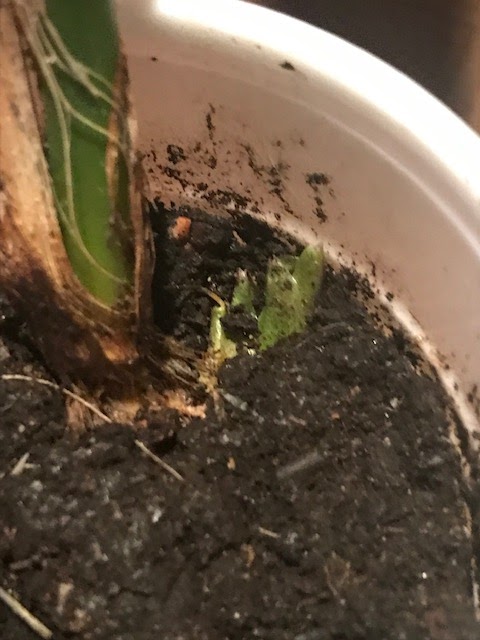
This screenshot has width=480, height=640. In order to click on to the right of the plant in this screenshot , I will do `click(126, 36)`.